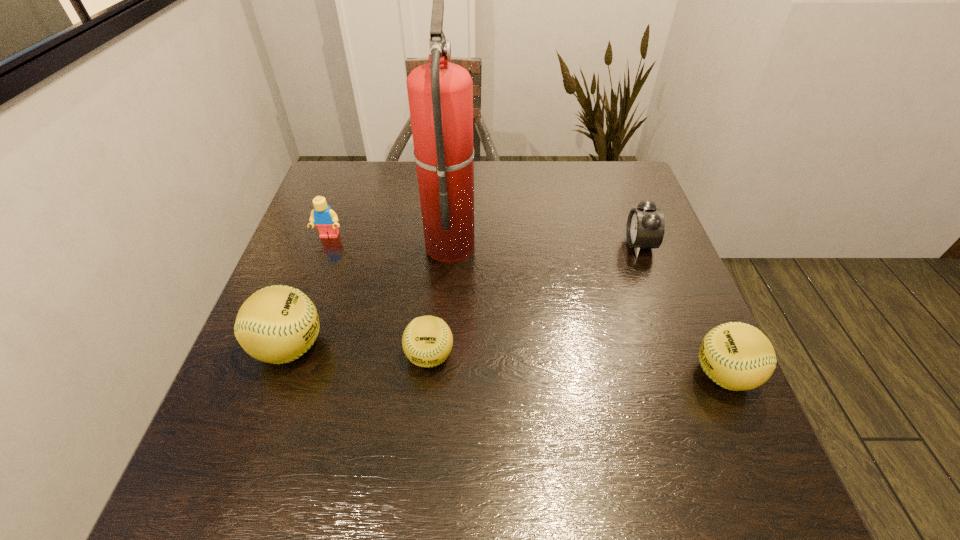
I want to click on the second tallest object, so click(277, 324).

You are a GUI agent. You are given a task and a screenshot of the screen. Output one action in this format:
    pyautogui.click(x=<x>, y=<y>)
    Task: Click on the leftmost softball
    The height and width of the screenshot is (540, 960).
    Given the screenshot: What is the action you would take?
    pyautogui.click(x=277, y=324)

This screenshot has width=960, height=540. I want to click on the second softball from right to left, so click(427, 341).

The width and height of the screenshot is (960, 540). What are the coordinates of `the shortest object` in the screenshot? It's located at (427, 341).

I want to click on the rightmost softball, so coord(737,356).

Identify the location of alarm clock. [x=645, y=228].

The height and width of the screenshot is (540, 960). I want to click on fire extinguisher, so click(440, 94).

Where is `Lego`? This screenshot has width=960, height=540. Lego is located at coordinates (326, 220).

Locate an element on the screen. free location located on the logo side of the leftmost softball is located at coordinates (446, 347).

Where is `free space located on the logo side of the second tallest softball`? free space located on the logo side of the second tallest softball is located at coordinates (581, 374).